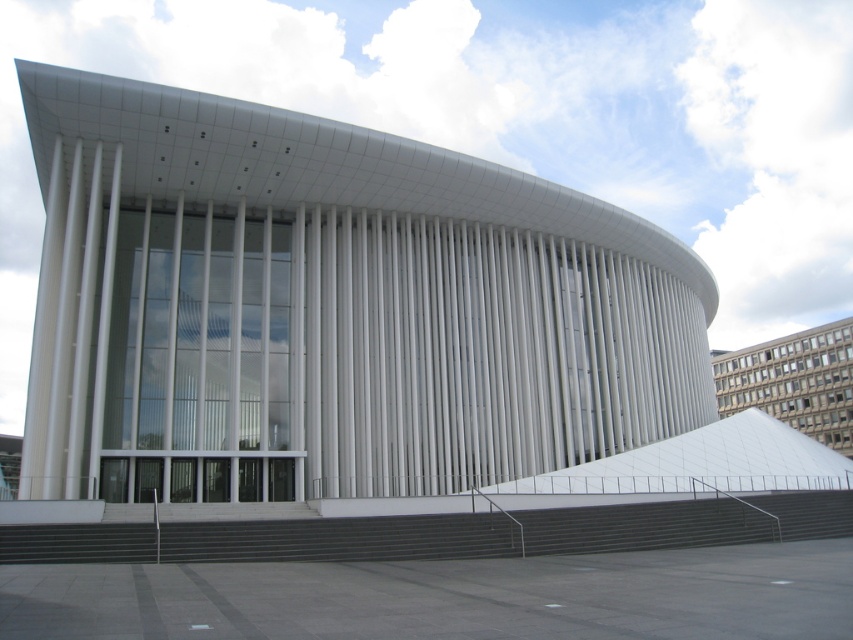
Is point (451, 246) closer to viewer compared to point (761, 358)?

Yes, it is in front of point (761, 358).

Is white smooth building at center positioned before white glass building at upper right?

Yes, white smooth building at center is closer to the viewer.

Who is more distant from viewer, (378, 362) or (769, 397)?

The point (769, 397) is more distant.

At what (x,y) coordinates should I click in order to perform the action: click on white smooth building at center. Please return your answer as a coordinate pair (x, y). Looking at the image, I should click on (329, 307).

Is dark gray concrete stairs at lower center further to camera compared to white glass building at upper right?

No, dark gray concrete stairs at lower center is closer to the viewer.

Does point (25, 540) come in front of point (810, 432)?

Yes, point (25, 540) is closer to viewer.

You are a GUI agent. You are given a task and a screenshot of the screen. Output one action in this format:
    pyautogui.click(x=<x>, y=<y>)
    Task: Click on the dark gray concrete stairs at lower center
    This screenshot has width=853, height=640.
    Given the screenshot: What is the action you would take?
    pyautogui.click(x=514, y=531)

Is white smooth building at center below dark gray concrete stairs at lower center?

Actually, white smooth building at center is above dark gray concrete stairs at lower center.

Locate an element on the screen. This screenshot has width=853, height=640. white smooth building at center is located at coordinates (329, 307).